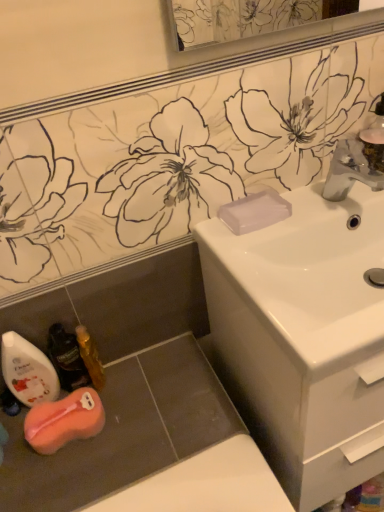
Question: Is satin nickel faucet at upper right touching white glossy sink at center?

Choices:
 (A) no
 (B) yes

Answer: (A)

Question: Can you confirm if satin nickel faucet at upper right is bigger than white glossy sink at center?

Choices:
 (A) no
 (B) yes

Answer: (A)

Question: Can white glossy sink at center be found inside satin nickel faucet at upper right?

Choices:
 (A) yes
 (B) no

Answer: (B)

Question: Is the depth of satin nickel faucet at upper right greater than that of white glossy sink at center?

Choices:
 (A) no
 (B) yes

Answer: (B)

Question: From a real-world perspective, is satin nickel faucet at upper right positioned over white glossy sink at center based on gravity?

Choices:
 (A) yes
 (B) no

Answer: (A)

Question: From the image's perspective, relative to orange sponge at lower left, is gold metallic mouthwash at lower left, which ranks as the first mouthwash in right-to-left order, above or below?

Choices:
 (A) below
 (B) above

Answer: (B)

Question: Visually, is gold metallic mouthwash at lower left, which ranks as the first mouthwash in right-to-left order, positioned to the left or to the right of orange sponge at lower left?

Choices:
 (A) right
 (B) left

Answer: (A)

Question: From a real-world perspective, is gold metallic mouthwash at lower left, which is counted as the third mouthwash, starting from the left, above or below orange sponge at lower left?

Choices:
 (A) below
 (B) above

Answer: (B)

Question: Considering the positions of gold metallic mouthwash at lower left, which is counted as the third mouthwash, starting from the left, and orange sponge at lower left in the image, is gold metallic mouthwash at lower left, which is counted as the third mouthwash, starting from the left, bigger or smaller than orange sponge at lower left?

Choices:
 (A) big
 (B) small

Answer: (B)

Question: Looking at their shapes, would you say satin nickel faucet at upper right is wider or thinner than transparent plastic soap at sink right?

Choices:
 (A) thin
 (B) wide

Answer: (B)

Question: From a real-world perspective, relative to transparent plastic soap at sink right, is satin nickel faucet at upper right vertically above or below?

Choices:
 (A) below
 (B) above

Answer: (B)

Question: Is satin nickel faucet at upper right in front of or behind transparent plastic soap at sink right in the image?

Choices:
 (A) behind
 (B) front

Answer: (B)

Question: Is satin nickel faucet at upper right bigger or smaller than transparent plastic soap at sink right?

Choices:
 (A) big
 (B) small

Answer: (A)

Question: In terms of size, does white glossy mouthwash at lower left, the third mouthwash positioned from the right, appear bigger or smaller than translucent plastic mouthwash at lower left, marked as the 2th mouthwash in a left-to-right arrangement?

Choices:
 (A) big
 (B) small

Answer: (A)

Question: Is white glossy mouthwash at lower left, the third mouthwash positioned from the right, wider or thinner than translucent plastic mouthwash at lower left, positioned as the 2th mouthwash in right-to-left order?

Choices:
 (A) thin
 (B) wide

Answer: (B)